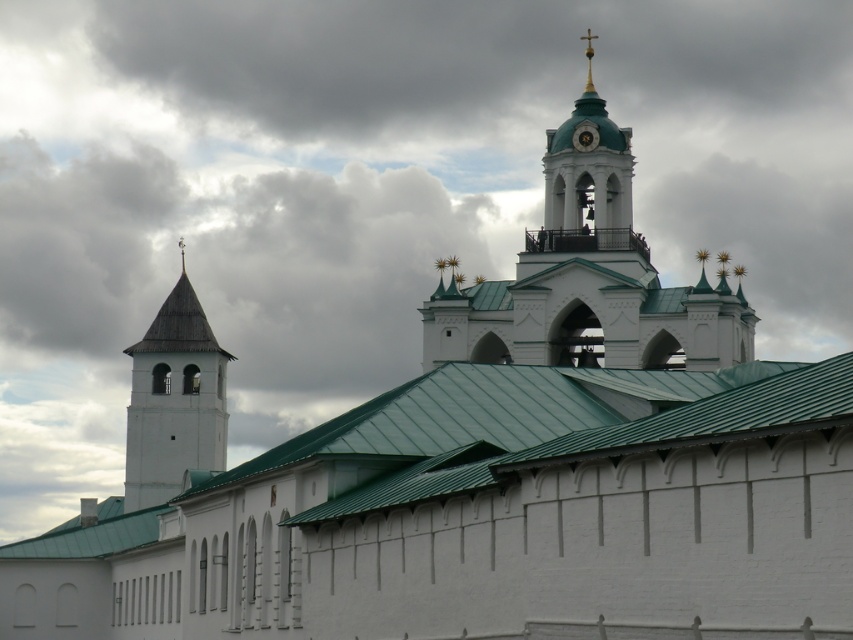
Is white stone tower at left shorter than gold metallic clock at upper center?

No, white stone tower at left is not shorter than gold metallic clock at upper center.

The image size is (853, 640). What are the coordinates of `white stone tower at left` in the screenshot? It's located at (173, 401).

Who is shorter, white stone tower at left or green matte bell tower at upper center?

green matte bell tower at upper center

Who is positioned more to the left, white stone tower at left or green matte bell tower at upper center?

white stone tower at left is more to the left.

You are a GUI agent. You are given a task and a screenshot of the screen. Output one action in this format:
    pyautogui.click(x=<x>, y=<y>)
    Task: Click on the white stone tower at left
    
    Given the screenshot: What is the action you would take?
    pyautogui.click(x=173, y=401)

At what (x,y) coordinates should I click in order to perform the action: click on green matte bell tower at upper center. Please return your answer as a coordinate pair (x, y). Looking at the image, I should click on (589, 168).

Can you confirm if green matte bell tower at upper center is taller than gold metallic clock at upper center?

→ Correct, green matte bell tower at upper center is much taller as gold metallic clock at upper center.

Between point (544, 150) and point (579, 140), which one is positioned in front?

Point (579, 140) is in front.

You are a GUI agent. You are given a task and a screenshot of the screen. Output one action in this format:
    pyautogui.click(x=<x>, y=<y>)
    Task: Click on the green matte bell tower at upper center
    This screenshot has width=853, height=640.
    Given the screenshot: What is the action you would take?
    pyautogui.click(x=589, y=168)